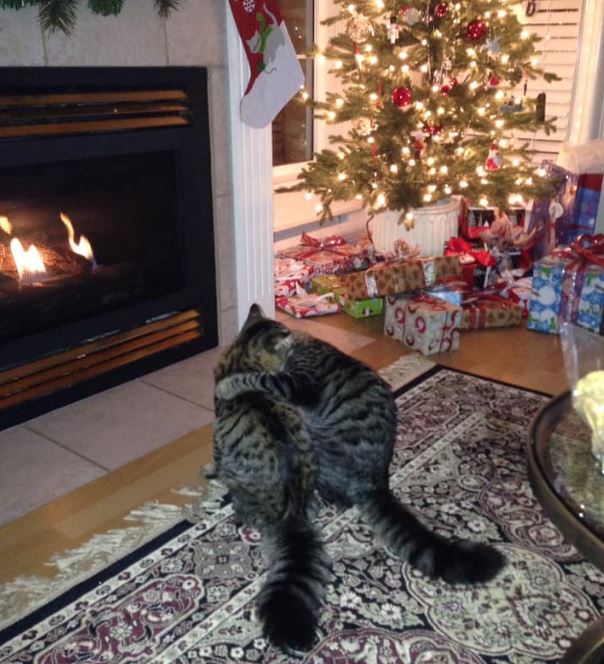
Where is `christmas gifts`? The width and height of the screenshot is (604, 664). christmas gifts is located at coordinates (568, 281), (591, 226), (503, 303), (439, 273), (425, 344), (362, 307), (354, 286), (335, 258), (296, 279), (319, 303).